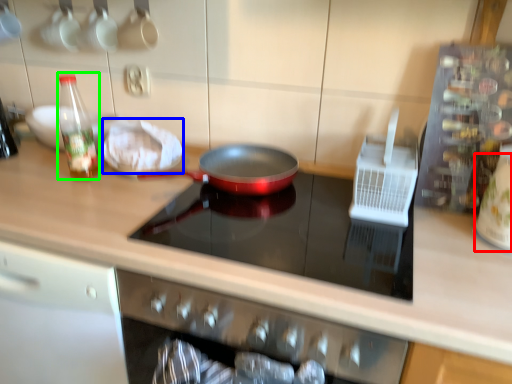
Question: Which object is positioned farthest from appliance (highlighted by a red box)? Select from food (highlighted by a blue box) and bottle (highlighted by a green box).

Choices:
 (A) food
 (B) bottle

Answer: (B)